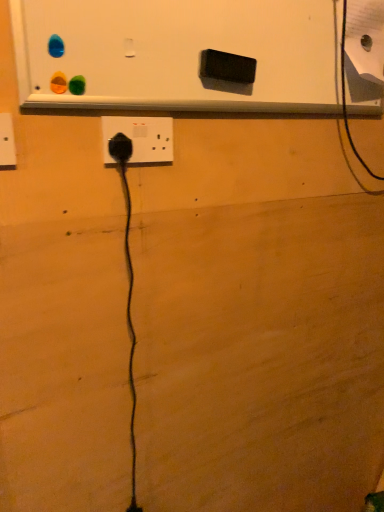
Question: From a real-world perspective, is black plastic power plug at left, which is the 1th power plugs and sockets in left-to-right order, over white matte bulletin board at upper center?

Choices:
 (A) yes
 (B) no

Answer: (B)

Question: Does black plastic power plug at left, the third power plugs and sockets from the back, contain white matte bulletin board at upper center?

Choices:
 (A) no
 (B) yes

Answer: (A)

Question: From the image's perspective, is black plastic power plug at left, the third power plugs and sockets from the back, beneath white matte bulletin board at upper center?

Choices:
 (A) no
 (B) yes

Answer: (B)

Question: Does black plastic power plug at left, the 1th power plugs and sockets positioned from the front, have a greater height compared to white matte bulletin board at upper center?

Choices:
 (A) yes
 (B) no

Answer: (B)

Question: Is black plastic power plug at left, the third power plugs and sockets from the back, oriented towards white matte bulletin board at upper center?

Choices:
 (A) yes
 (B) no

Answer: (B)

Question: Based on their sizes in the image, would you say black rubber power plug at center, the second power plugs and sockets from the right, is bigger or smaller than black plastic power plug at center, marked as the 2th power plugs and sockets in a back-to-front arrangement?

Choices:
 (A) big
 (B) small

Answer: (B)

Question: Based on their positions, is black rubber power plug at center, the 3th power plugs and sockets positioned from the front, located to the left or right of black plastic power plug at center, which is the 2th power plugs and sockets in front-to-back order?

Choices:
 (A) left
 (B) right

Answer: (A)

Question: Considering the positions of black rubber power plug at center, marked as the 2th power plugs and sockets in a left-to-right arrangement, and black plastic power plug at center, which is the 2th power plugs and sockets in front-to-back order, in the image, is black rubber power plug at center, marked as the 2th power plugs and sockets in a left-to-right arrangement, wider or thinner than black plastic power plug at center, which is the 2th power plugs and sockets in front-to-back order,?

Choices:
 (A) wide
 (B) thin

Answer: (A)

Question: Considering the positions of point (132, 146) and point (150, 148), is point (132, 146) closer or farther from the camera than point (150, 148)?

Choices:
 (A) closer
 (B) farther

Answer: (A)

Question: Do you think black plastic power plug at center, marked as the 2th power plugs and sockets in a back-to-front arrangement, is within black rubber power plug at center, placed as the first power plugs and sockets when sorted from back to front, or outside of it?

Choices:
 (A) inside
 (B) outside

Answer: (B)

Question: From a real-world perspective, is black plastic power plug at center, the 1th power plugs and sockets in the right-to-left sequence, physically located above or below black rubber power plug at center, placed as the first power plugs and sockets when sorted from back to front?

Choices:
 (A) below
 (B) above

Answer: (B)

Question: Does point (160, 153) appear closer or farther from the camera than point (130, 138)?

Choices:
 (A) closer
 (B) farther

Answer: (B)

Question: Considering the relative positions of black plastic power plug at center, the 1th power plugs and sockets in the right-to-left sequence, and black rubber power plug at center, the second power plugs and sockets from the right, in the image provided, is black plastic power plug at center, the 1th power plugs and sockets in the right-to-left sequence, to the left or to the right of black rubber power plug at center, the second power plugs and sockets from the right,?

Choices:
 (A) left
 (B) right

Answer: (B)

Question: In terms of size, does white matte bulletin board at upper center appear bigger or smaller than black plastic power plug at left, the 1th power plugs and sockets positioned from the front?

Choices:
 (A) small
 (B) big

Answer: (B)

Question: From the image's perspective, is white matte bulletin board at upper center positioned above or below black plastic power plug at left, the third power plugs and sockets from the right?

Choices:
 (A) above
 (B) below

Answer: (A)